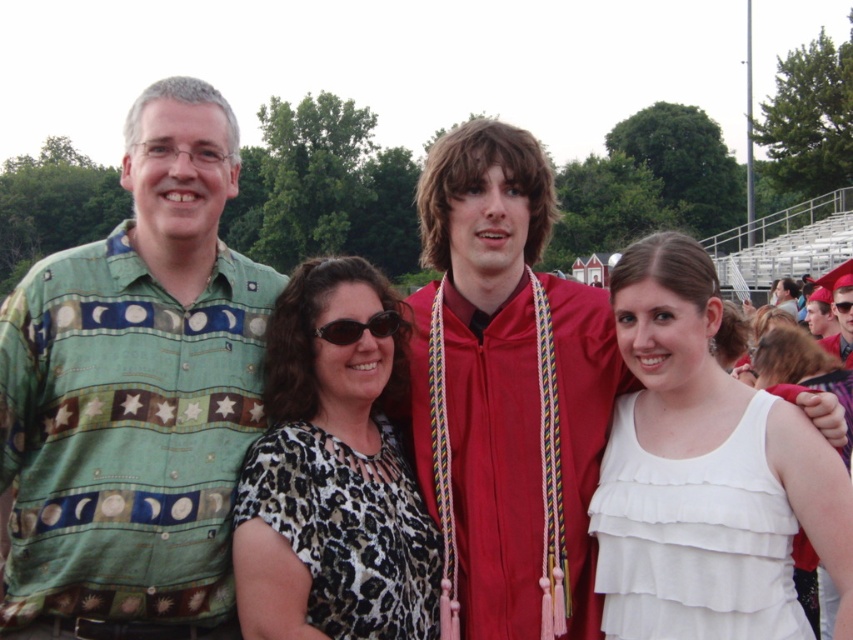
Is the position of green textured shirt at left more distant than that of maroon satin robe at center?

No, it is not.

Between point (106, 579) and point (463, 349), which one is positioned in front?

Positioned in front is point (106, 579).

Does point (28, 472) come behind point (575, 536)?

That is False.

Image resolution: width=853 pixels, height=640 pixels. Identify the location of green textured shirt at left. (134, 396).

Describe the element at coordinates (334, 472) in the screenshot. I see `leopard print blouse at center` at that location.

What are the coordinates of `leopard print blouse at center` in the screenshot? It's located at (334, 472).

Find the location of `leopard print blouse at center`. leopard print blouse at center is located at coordinates (334, 472).

Measure the distance from green textured shirt at left to leopard print blouse at center.

green textured shirt at left and leopard print blouse at center are 1.40 meters apart from each other.

At what (x,y) coordinates should I click in order to perform the action: click on green textured shirt at left. Please return your answer as a coordinate pair (x, y). Image resolution: width=853 pixels, height=640 pixels. Looking at the image, I should click on (134, 396).

Between point (28, 417) and point (386, 465), which one is positioned behind?

The point (386, 465) is behind.

Identify the location of green textured shirt at left. (134, 396).